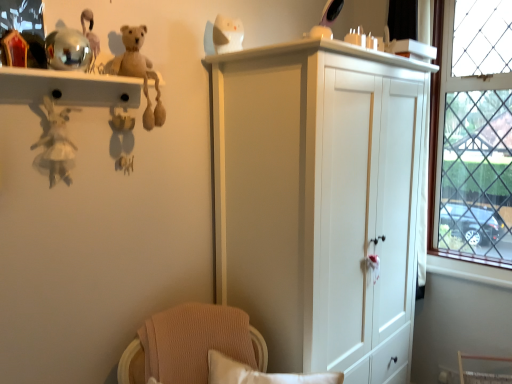
Question: Can you confirm if white fabric doll at left, the first toy in the left-to-right sequence, is shorter than metallic gold toy at upper left, which appears as the 4th toy when viewed from the right?

Choices:
 (A) yes
 (B) no

Answer: (B)

Question: From the image's perspective, is white fabric doll at left, the 5th toy viewed from the right, beneath metallic gold toy at upper left, the second toy when ordered from left to right?

Choices:
 (A) no
 (B) yes

Answer: (B)

Question: Is white fabric doll at left, the 5th toy viewed from the right, taller than metallic gold toy at upper left, which appears as the 4th toy when viewed from the right?

Choices:
 (A) yes
 (B) no

Answer: (A)

Question: Does white fabric doll at left, the first toy in the left-to-right sequence, turn towards metallic gold toy at upper left, the second toy when ordered from left to right?

Choices:
 (A) no
 (B) yes

Answer: (A)

Question: From a real-world perspective, is white fabric doll at left, the first toy in the left-to-right sequence, under metallic gold toy at upper left, which appears as the 4th toy when viewed from the right?

Choices:
 (A) no
 (B) yes

Answer: (B)

Question: Is white fabric doll at left, the 5th toy viewed from the right, not near metallic gold toy at upper left, which appears as the 4th toy when viewed from the right?

Choices:
 (A) yes
 (B) no

Answer: (B)

Question: Does white fabric doll at left, the 5th toy viewed from the right, appear on the right side of beige plush bear at upper left, which is the 3th toy in left-to-right order?

Choices:
 (A) yes
 (B) no

Answer: (B)

Question: Considering the relative sizes of white fabric doll at left, the 5th toy viewed from the right, and beige plush bear at upper left, which is the 3th toy in left-to-right order, in the image provided, is white fabric doll at left, the 5th toy viewed from the right, smaller than beige plush bear at upper left, which is the 3th toy in left-to-right order,?

Choices:
 (A) yes
 (B) no

Answer: (A)

Question: Is white fabric doll at left, the 5th toy viewed from the right, not near beige plush bear at upper left, which is the 3th toy in left-to-right order?

Choices:
 (A) yes
 (B) no

Answer: (B)

Question: Considering the relative sizes of white fabric doll at left, the first toy in the left-to-right sequence, and beige plush bear at upper left, which ranks as the 3th toy in right-to-left order, in the image provided, is white fabric doll at left, the first toy in the left-to-right sequence, shorter than beige plush bear at upper left, which ranks as the 3th toy in right-to-left order,?

Choices:
 (A) yes
 (B) no

Answer: (A)

Question: Is white fabric doll at left, the first toy in the left-to-right sequence, closer to camera compared to beige plush bear at upper left, which is the 3th toy in left-to-right order?

Choices:
 (A) no
 (B) yes

Answer: (B)

Question: From a real-world perspective, is white fabric doll at left, the first toy in the left-to-right sequence, below beige plush bear at upper left, which ranks as the 3th toy in right-to-left order?

Choices:
 (A) yes
 (B) no

Answer: (A)

Question: From the image's perspective, is clear glass window at right above metallic gold toy at upper left, which appears as the 4th toy when viewed from the right?

Choices:
 (A) yes
 (B) no

Answer: (A)